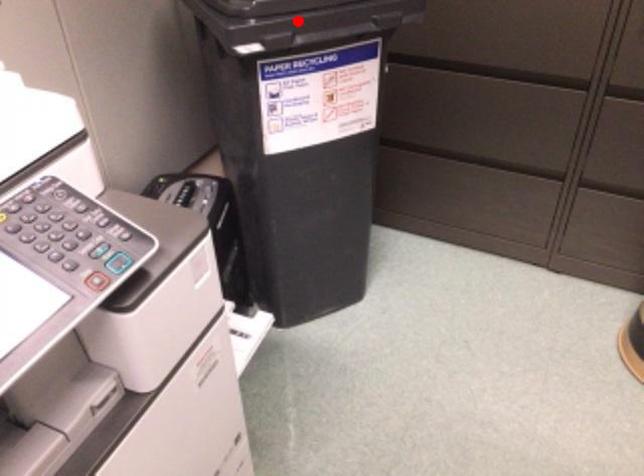
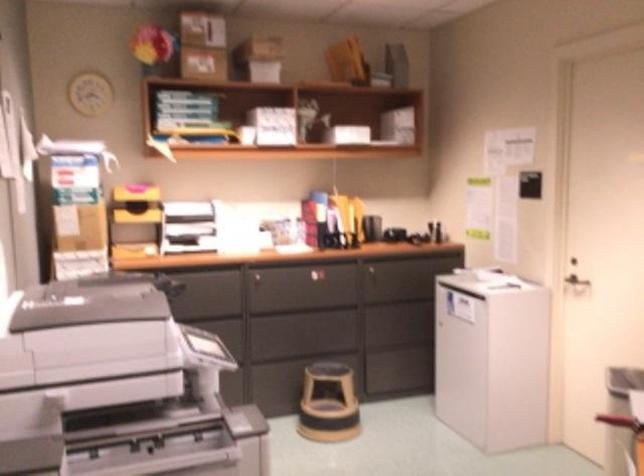
Question: I am providing you with two images of the same scene from different viewpoints. A red point is marked on the first image. At the location where the point appears in image 1, is it still visible in image 2?

Choices:
 (A) Yes
 (B) No

Answer: (B)